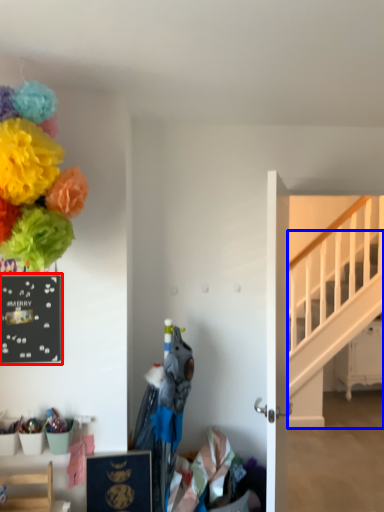
Question: Among these objects, which one is farthest to the camera, bulletin board (highlighted by a red box) or stairs (highlighted by a blue box)?

Choices:
 (A) bulletin board
 (B) stairs

Answer: (B)